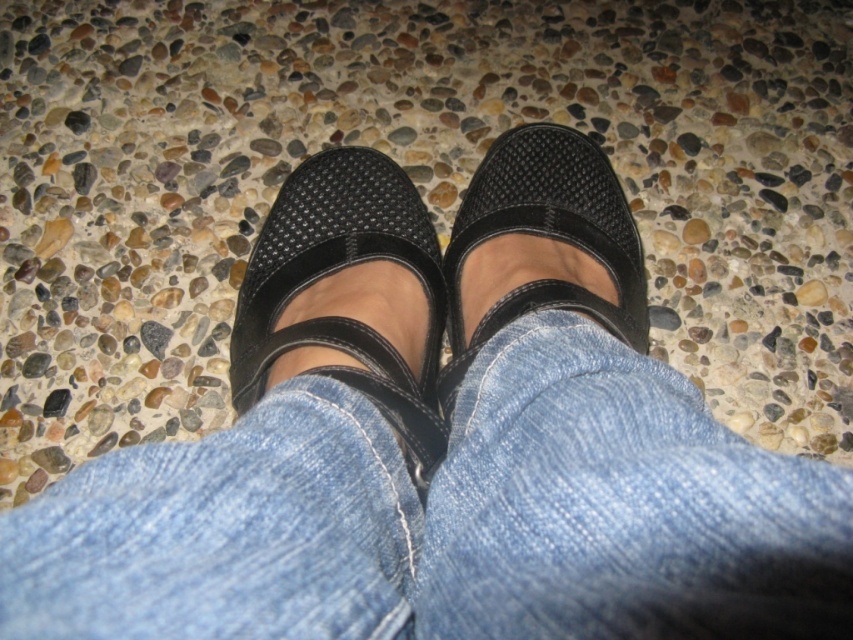
Can you confirm if matte black mary jane shoes at center is positioned above black mesh sandal at center?

Actually, matte black mary jane shoes at center is below black mesh sandal at center.

Looking at this image, does matte black mary jane shoes at center appear on the right side of black mesh sandal at center?

In fact, matte black mary jane shoes at center is to the left of black mesh sandal at center.

Consider the image. Who is more forward, [341,365] or [549,131]?

Point [341,365] is in front.

At what (x,y) coordinates should I click in order to perform the action: click on matte black mary jane shoes at center. Please return your answer as a coordinate pair (x, y). The image size is (853, 640). Looking at the image, I should click on (332, 273).

You are a GUI agent. You are given a task and a screenshot of the screen. Output one action in this format:
    pyautogui.click(x=<x>, y=<y>)
    Task: Click on the denim at center
    
    Given the screenshot: What is the action you would take?
    pyautogui.click(x=447, y=518)

Measure the distance from denim at center to matte black mary jane shoes at center.

denim at center and matte black mary jane shoes at center are 8.41 inches apart from each other.

Locate an element on the screen. The image size is (853, 640). denim at center is located at coordinates (447, 518).

At what (x,y) coordinates should I click in order to perform the action: click on denim at center. Please return your answer as a coordinate pair (x, y). Looking at the image, I should click on (447, 518).

What do you see at coordinates (447, 518) in the screenshot? I see `denim at center` at bounding box center [447, 518].

Which is in front, point (0, 516) or point (502, 310)?

Point (0, 516)

Does point (556, 412) come farther from viewer compared to point (639, 291)?

No, (556, 412) is closer to viewer.

The height and width of the screenshot is (640, 853). I want to click on denim at center, so click(x=447, y=518).